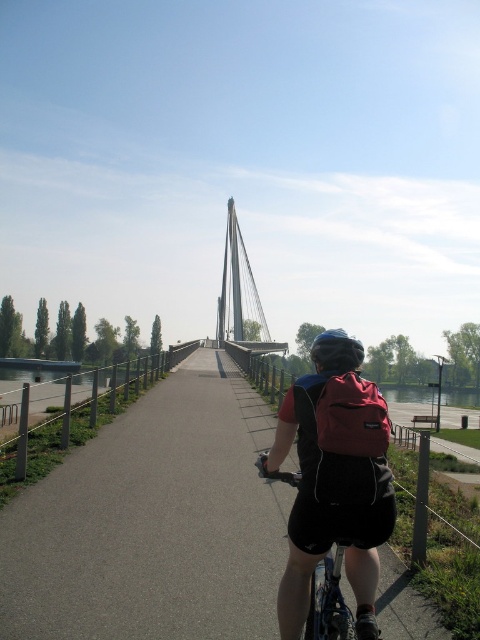
Consider the image. You are a photographer standing on the path. You want to take a photo of the silver metallic suspension bridge at center while ensuring the matte black helmet at center is also visible in the frame. Is the bridge large enough to be recognizable in the photo if the helmet is included?

The silver metallic suspension bridge at center is larger than the matte black helmet at center, so it should still be recognizable in the photo even when both are included.

You are a drone operator trying to capture a photo of the cyclist from above. The drone is currently hovering at point A, which is at coordinates 0.7, 0.3. To get the best shot, you need to position the drone directly above the cyclist on the black asphalt path at center. Should you move the drone north or south to align it with the path?

The black asphalt path at center is located at point (154, 522). Since the drone is at (144, 448), it needs to move north to increase the y coordinate from 0.3 to 0.321 and east to increase the x coordinate from 0.7 to 0.817. However, the question specifically asks north or south. Comparing the y coordinates, 0.321 is north of 0.3, so move north.

You are standing at the point marked by the coordinates point (154, 522). What object are you standing on?

You are standing on the black asphalt path at center, which is located at point (154, 522).